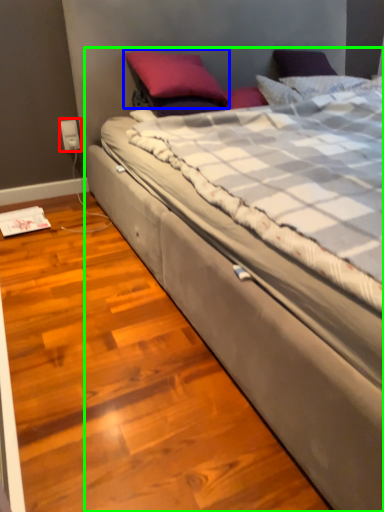
Question: Which object is the farthest from electric outlet (highlighted by a red box)? Choose among these: pillow (highlighted by a blue box) or bed (highlighted by a green box).

Choices:
 (A) pillow
 (B) bed

Answer: (B)